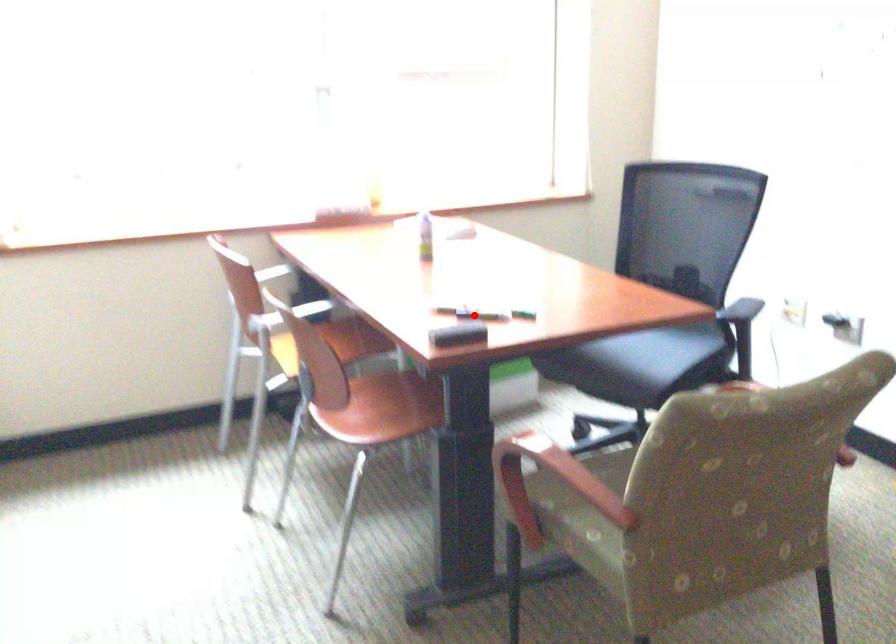
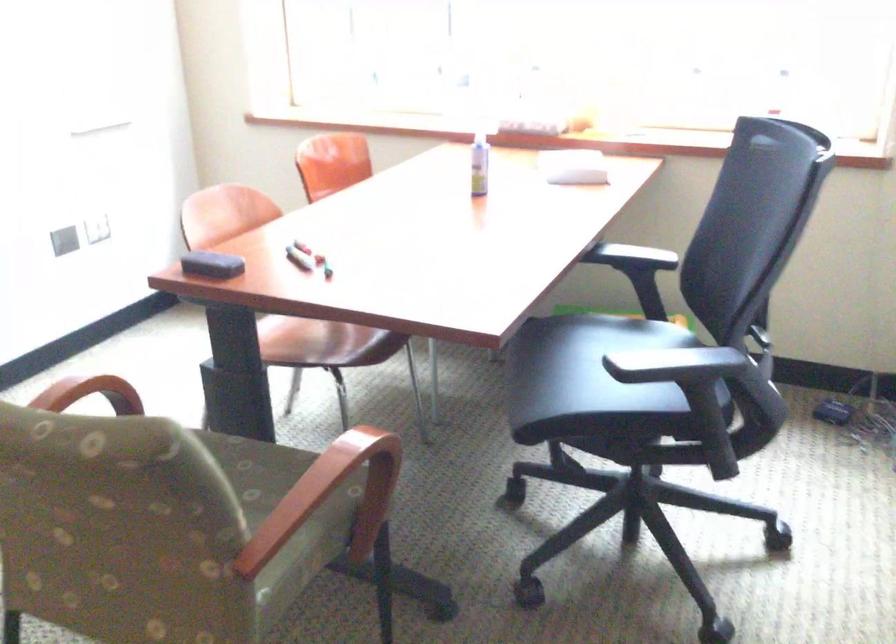
Question: A red point is marked in image1. In image2, is the corresponding 3D point closer to the camera or farther? Reply with the corresponding letter.

Choices:
 (A) The corresponding 3D point is closer.
 (B) The corresponding 3D point is farther.

Answer: (A)